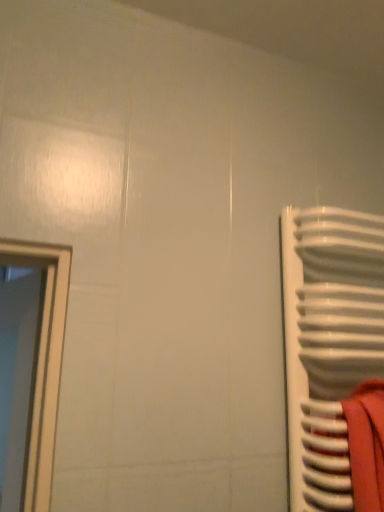
Question: From a real-world perspective, is white glossy door at left above or below white glossy radiator at right?

Choices:
 (A) above
 (B) below

Answer: (A)

Question: Would you say white glossy door at left is inside or outside white glossy radiator at right?

Choices:
 (A) inside
 (B) outside

Answer: (B)

Question: Is white glossy door at left bigger or smaller than white glossy radiator at right?

Choices:
 (A) small
 (B) big

Answer: (B)

Question: Based on their positions, is white glossy radiator at right located to the left or right of white glossy door at left?

Choices:
 (A) right
 (B) left

Answer: (A)

Question: Relative to white glossy door at left, is white glossy radiator at right in front or behind?

Choices:
 (A) behind
 (B) front

Answer: (B)

Question: Is white glossy radiator at right situated inside white glossy door at left or outside?

Choices:
 (A) outside
 (B) inside

Answer: (A)

Question: Considering the positions of white glossy radiator at right and white glossy door at left in the image, is white glossy radiator at right bigger or smaller than white glossy door at left?

Choices:
 (A) big
 (B) small

Answer: (B)